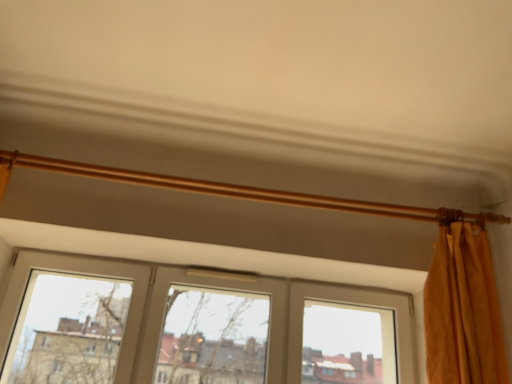
What do you see at coordinates (211, 288) in the screenshot? I see `white plastic window at lower center` at bounding box center [211, 288].

Identify the location of white plastic window at lower center. This screenshot has height=384, width=512. (211, 288).

The height and width of the screenshot is (384, 512). Identify the location of white plastic window at lower center. (211, 288).